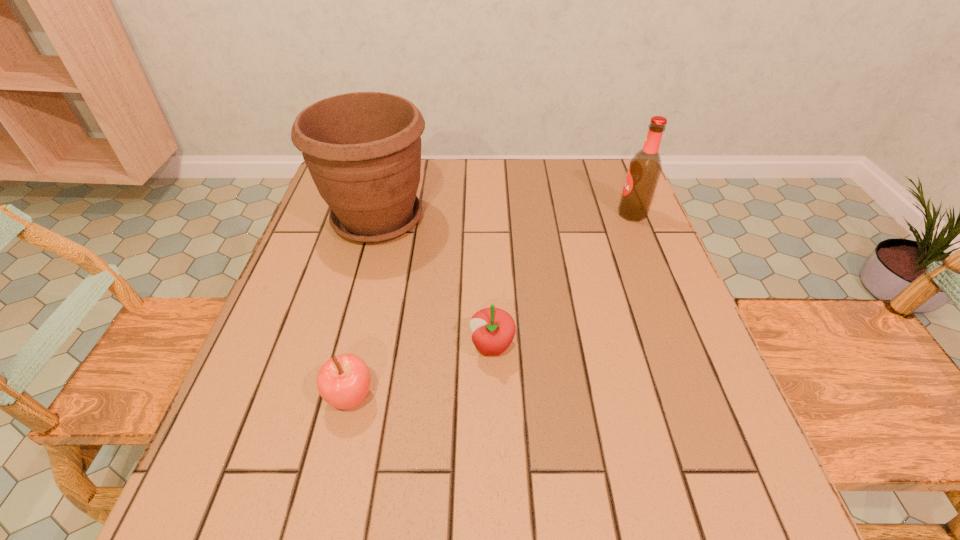
You are a GUI agent. You are given a task and a screenshot of the screen. Output one action in this format:
    pyautogui.click(x=<x>, y=<y>)
    Task: Click on the flowerpot at the far edge
    Image resolution: width=960 pixels, height=540 pixels.
    Given the screenshot: What is the action you would take?
    pyautogui.click(x=363, y=150)

What are the coordinates of `beer bottle located at the far edge` in the screenshot? It's located at (645, 167).

This screenshot has height=540, width=960. Identify the location of flowerpot that is at the left edge. (363, 150).

Identify the location of apple present at the left edge. This screenshot has width=960, height=540. (343, 381).

This screenshot has width=960, height=540. What are the coordinates of `object present at the right edge` in the screenshot? It's located at coord(645,167).

Identify the location of object located in the far left corner section of the desktop. This screenshot has height=540, width=960. (363, 150).

Locate an element on the screen. object that is at the far right corner is located at coordinates (645, 167).

This screenshot has width=960, height=540. In the image, there is a desktop. What are the coordinates of `vacant space at the far edge` in the screenshot? It's located at (468, 171).

Find the location of a particular element. Image resolution: width=960 pixels, height=540 pixels. vacant space at the left edge of the desktop is located at coordinates (283, 301).

In order to click on free space at the right edge in this screenshot , I will do `click(614, 256)`.